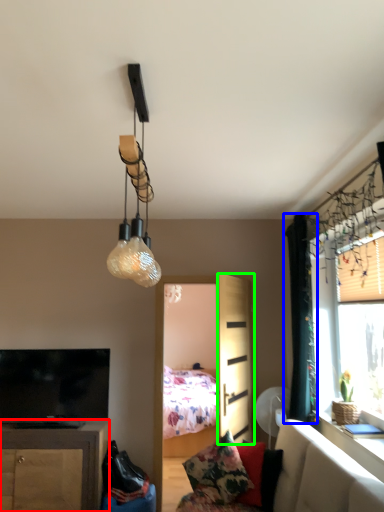
Question: Considering the real-world distances, which object is farthest from cabinetry (highlighted by a red box)? curtain (highlighted by a blue box) or screen door (highlighted by a green box)?

Choices:
 (A) curtain
 (B) screen door

Answer: (A)